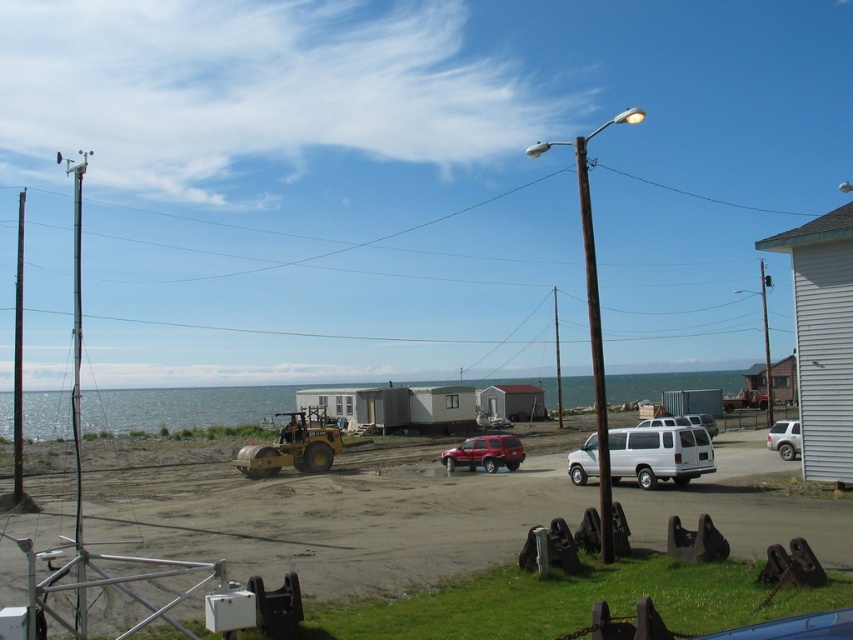
Who is lower down, white matte van at center or white matte van at center-right?

Positioned lower is white matte van at center-right.

The width and height of the screenshot is (853, 640). Describe the element at coordinates (659, 452) in the screenshot. I see `white matte van at center` at that location.

You are a GUI agent. You are given a task and a screenshot of the screen. Output one action in this format:
    pyautogui.click(x=<x>, y=<y>)
    Task: Click on the white matte van at center
    
    Given the screenshot: What is the action you would take?
    pyautogui.click(x=659, y=452)

Can you confirm if metallic pole at center is smaller than white matte van at center-right?

Incorrect, metallic pole at center is not smaller in size than white matte van at center-right.

Who is positioned more to the right, metallic pole at center or white matte van at center-right?

Positioned to the right is metallic pole at center.

Is point (555, 337) farther from camera compared to point (709, 428)?

Yes, it is.

This screenshot has height=640, width=853. I want to click on metallic pole at center, so click(x=556, y=358).

Is matte yellow road roller at center shorter than white matte car at right?

Incorrect, matte yellow road roller at center's height does not fall short of white matte car at right's.

Who is positioned more to the left, matte yellow road roller at center or white matte car at right?

From the viewer's perspective, matte yellow road roller at center appears more on the left side.

Which is behind, point (317, 458) or point (773, 426)?

The point (773, 426) is behind.

Locate an element on the screen. This screenshot has height=640, width=853. matte yellow road roller at center is located at coordinates (293, 445).